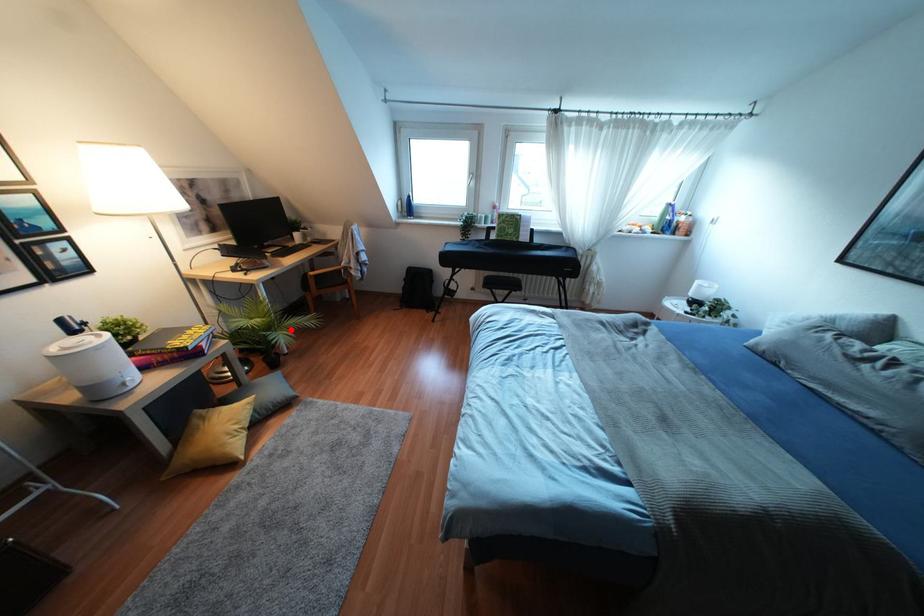
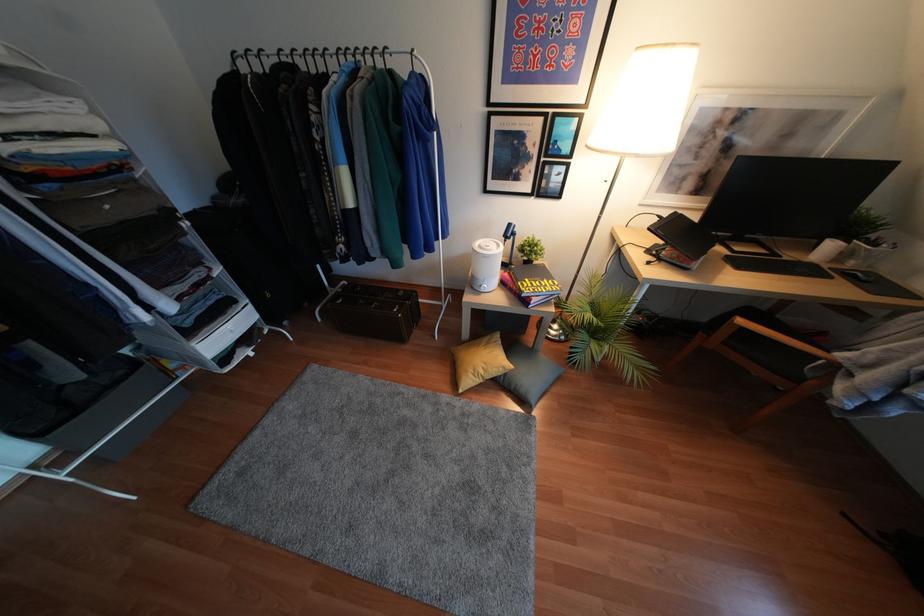
Where in the second image is the point corresponding to the highlighted location from the first image?

(604, 357)